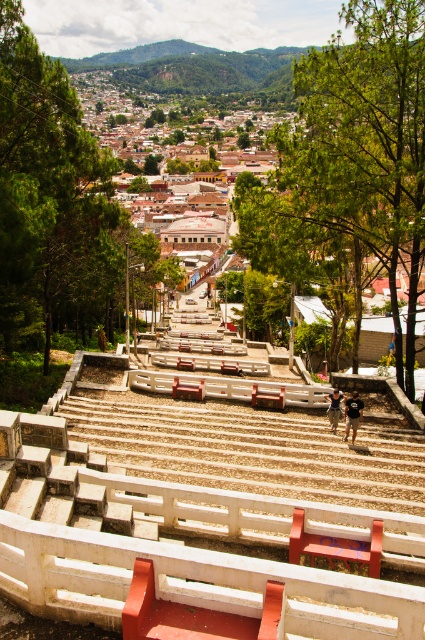
You are a landscape architect reviewing this urban park design. You notice two green leafy trees in the scene. Which tree, the green leafy tree at upper center or the green leafy tree at upper left, would cast a bigger shadow during midday?

The green leafy tree at upper center has a larger size compared to the green leafy tree at upper left, so it would cast a bigger shadow during midday.

You are standing at the top of the stone steps looking down towards the town. There is a green leafy tree at upper center. Can you see the tree from your current position?

Yes, the green leafy tree at upper center is located at point (365, 147), which is within your field of view from the top of the stone steps.